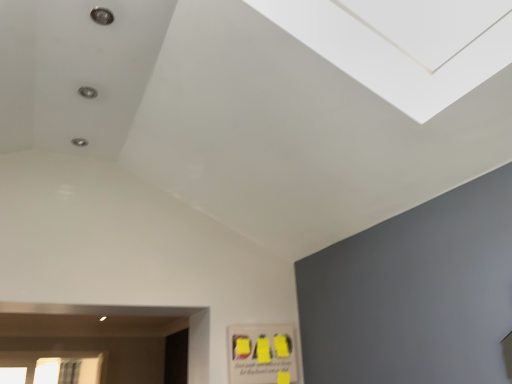
Question: Is yellow matte poster at lower right thinner than white glass window at lower left?

Choices:
 (A) yes
 (B) no

Answer: (A)

Question: Is yellow matte poster at lower right closer to the viewer compared to white glass window at lower left?

Choices:
 (A) yes
 (B) no

Answer: (A)

Question: From the image's perspective, is yellow matte poster at lower right located beneath white glass window at lower left?

Choices:
 (A) no
 (B) yes

Answer: (A)

Question: Does yellow matte poster at lower right have a greater width compared to white glass window at lower left?

Choices:
 (A) no
 (B) yes

Answer: (A)

Question: Is yellow matte poster at lower right far away from white glass window at lower left?

Choices:
 (A) no
 (B) yes

Answer: (B)

Question: From a real-world perspective, is yellow matte poster at lower right below white glass window at lower left?

Choices:
 (A) no
 (B) yes

Answer: (B)

Question: From the image's perspective, would you say white glass window at lower left is shown under yellow matte poster at lower right?

Choices:
 (A) no
 (B) yes

Answer: (B)

Question: Is white glass window at lower left aimed at yellow matte poster at lower right?

Choices:
 (A) no
 (B) yes

Answer: (B)

Question: Can you confirm if white glass window at lower left is smaller than yellow matte poster at lower right?

Choices:
 (A) yes
 (B) no

Answer: (B)

Question: Is white glass window at lower left bigger than yellow matte poster at lower right?

Choices:
 (A) yes
 (B) no

Answer: (A)

Question: Is white glass window at lower left positioned behind yellow matte poster at lower right?

Choices:
 (A) no
 (B) yes

Answer: (B)

Question: Can we say white glass window at lower left lies outside yellow matte poster at lower right?

Choices:
 (A) no
 (B) yes

Answer: (B)

Question: Is point (87, 380) positioned closer to the camera than point (284, 380)?

Choices:
 (A) closer
 (B) farther

Answer: (B)